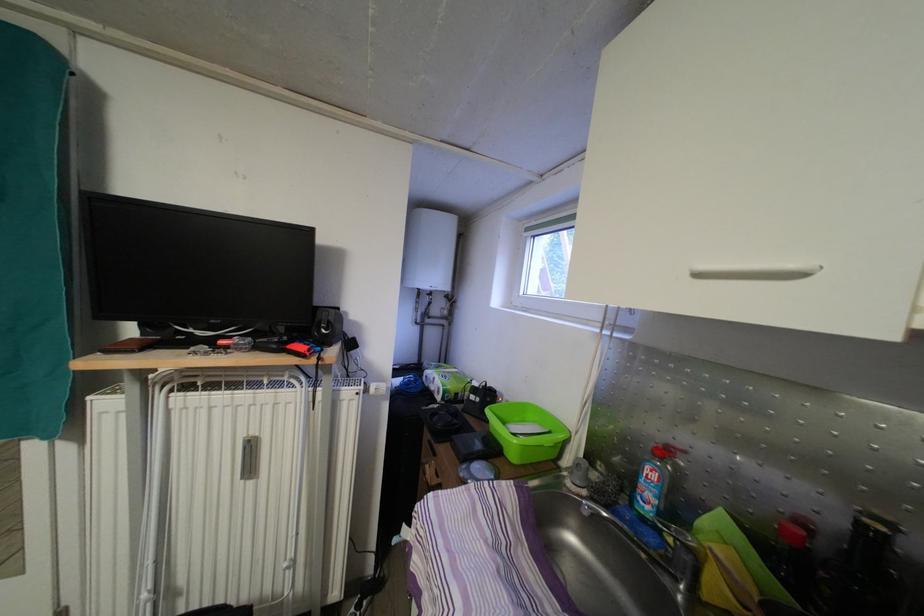
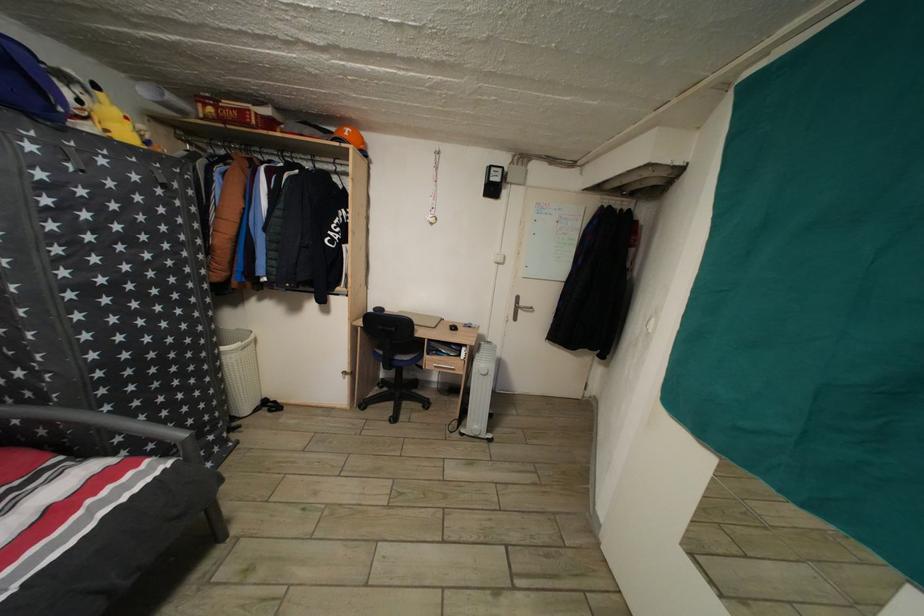
Question: The camera is either moving clockwise (left) or counter-clockwise (right) around the object. The first image is from the beginning of the video and the second image is from the end. Is the camera moving left or right when shooting the video?

Choices:
 (A) Left
 (B) Right

Answer: (B)